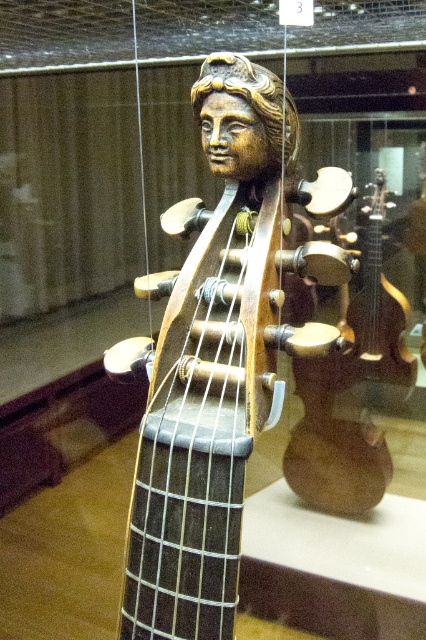
At what (x,y) coordinates should I click in order to perform the action: click on wooden carved head at center. Please return your answer as a coordinate pair (x, y). Looking at the image, I should click on (215, 394).

Does wooden carved head at center have a greater height compared to shiny gold guitar at center?

No.

In order to click on wooden carved head at center in this screenshot , I will do `click(215, 394)`.

You are a GUI agent. You are given a task and a screenshot of the screen. Output one action in this format:
    pyautogui.click(x=<x>, y=<y>)
    Task: Click on the wooden carved head at center
    The width and height of the screenshot is (426, 640).
    Given the screenshot: What is the action you would take?
    pyautogui.click(x=215, y=394)